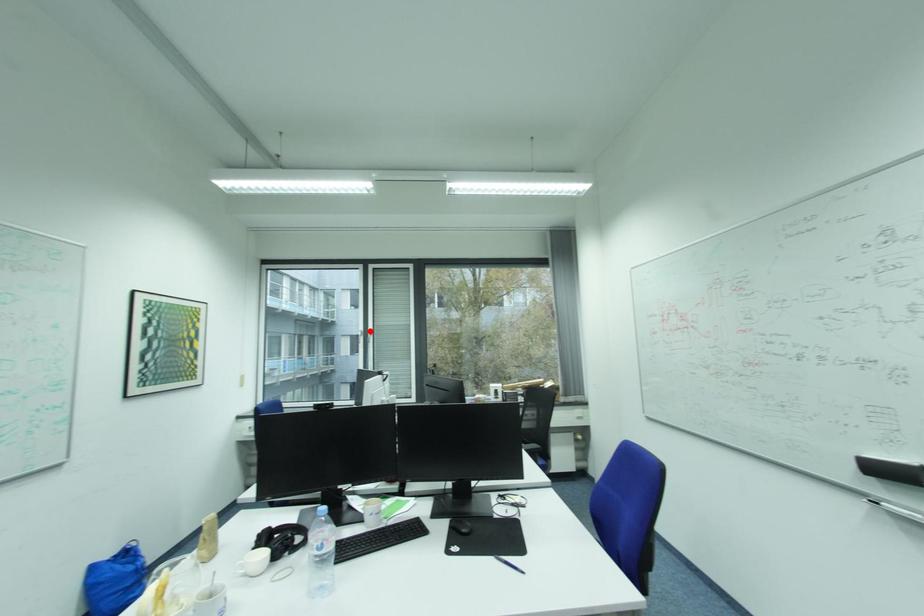
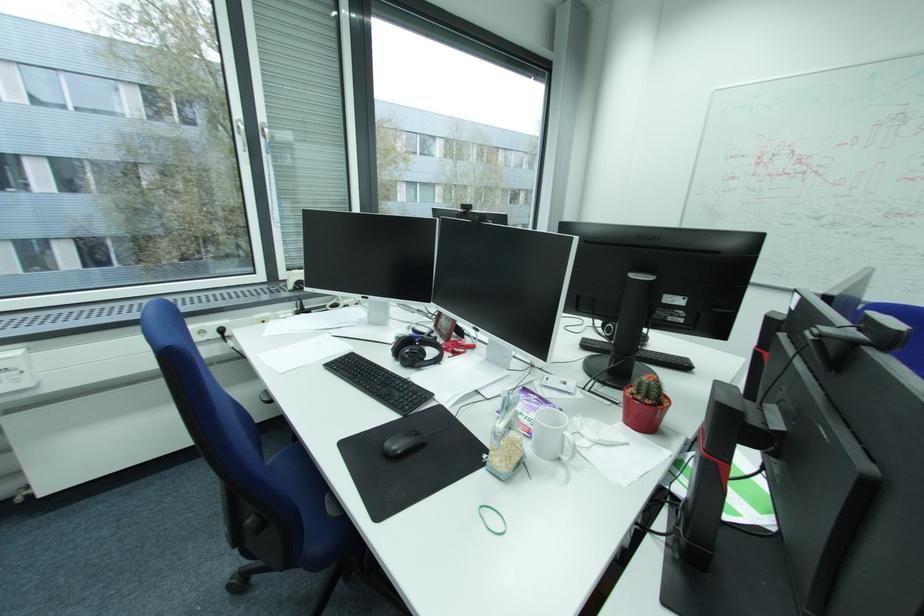
Find the pixel in the second image that matches the highlighted location in the first image.

(247, 121)